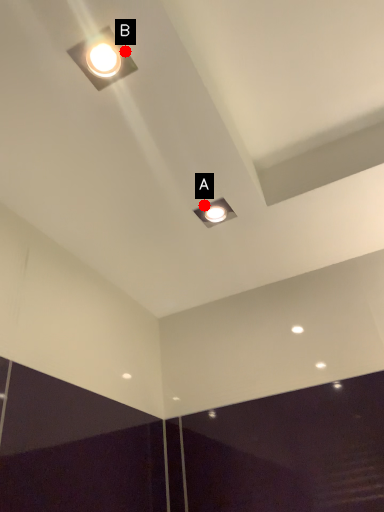
Question: Two points are circled on the image, labeled by A and B beside each circle. Which point appears farthest from the camera in this image?

Choices:
 (A) A is further
 (B) B is further

Answer: (A)